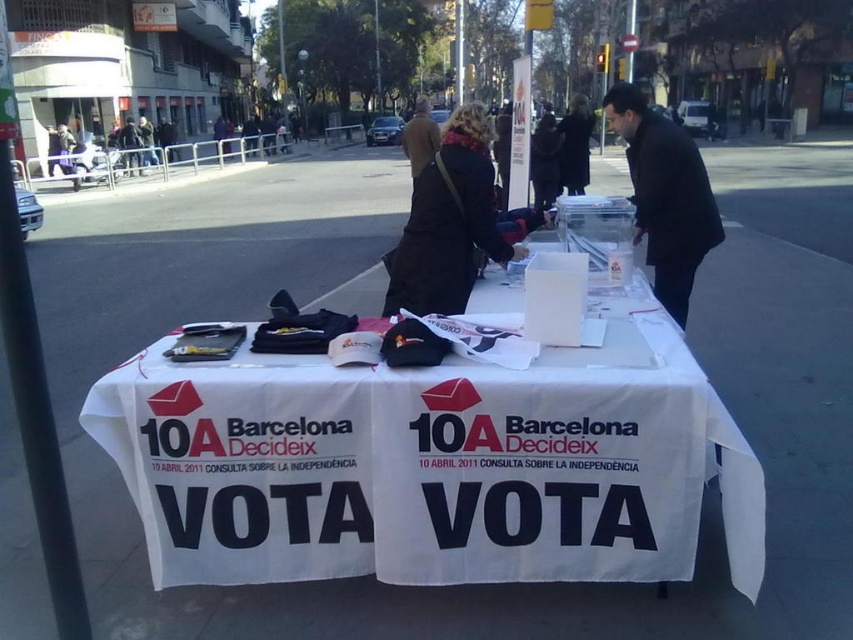
Who is positioned more to the right, black matte coat at center or black wool coat at center?

Positioned to the right is black wool coat at center.

Can you confirm if black matte coat at center is shorter than black wool coat at center?

Yes.

Does point (665, 138) lie in front of point (573, 186)?

Yes, it is.

You are a GUI agent. You are given a task and a screenshot of the screen. Output one action in this format:
    pyautogui.click(x=<x>, y=<y>)
    Task: Click on the black matte coat at center
    This screenshot has height=640, width=853.
    Given the screenshot: What is the action you would take?
    pyautogui.click(x=665, y=195)

Which is in front, point (410, 282) or point (567, 141)?

Point (410, 282)

Who is taller, black leather jacket at center or black wool coat at center?

Standing taller between the two is black wool coat at center.

Describe the element at coordinates (448, 221) in the screenshot. The image size is (853, 640). I see `black leather jacket at center` at that location.

Identify the location of black leather jacket at center. (448, 221).

Can you confirm if black leather jacket at center is positioned to the right of black matte coat at center?

In fact, black leather jacket at center is to the left of black matte coat at center.

Is black leather jacket at center further to camera compared to black matte coat at center?

Yes, it is behind black matte coat at center.

Measure the distance between black leather jacket at center and camera.

2.12 meters

Where is `black leather jacket at center`? The width and height of the screenshot is (853, 640). black leather jacket at center is located at coordinates (448, 221).